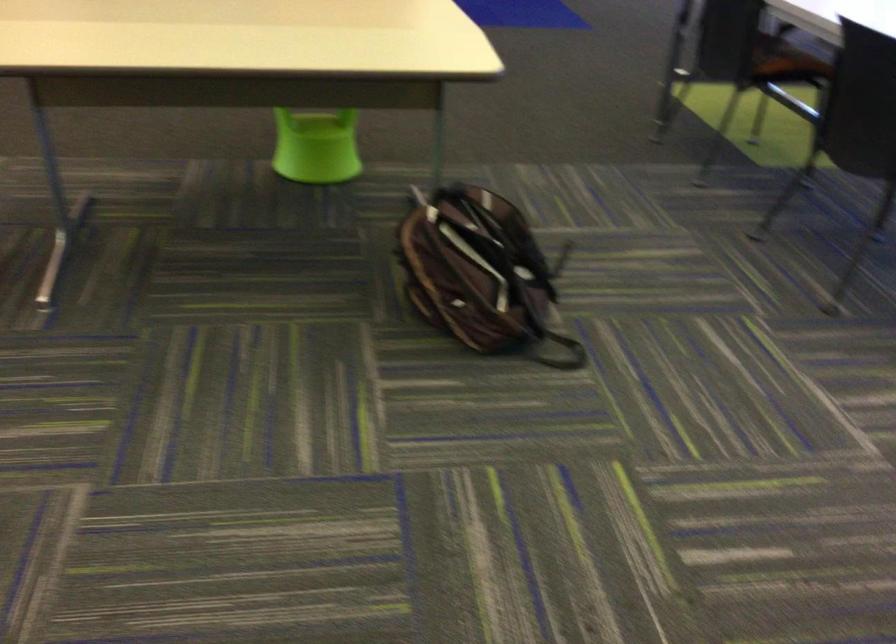
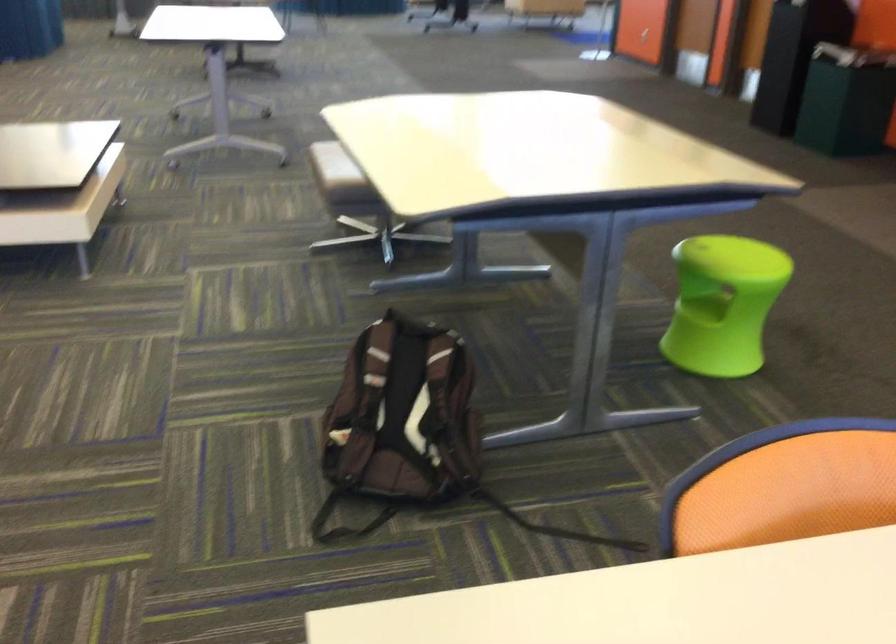
Where in the second image is the point corresponding to [498,260] from the first image?

(402, 413)